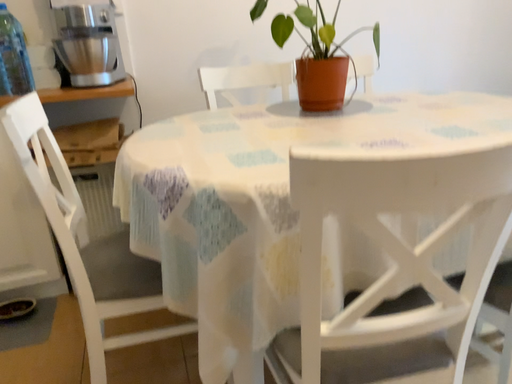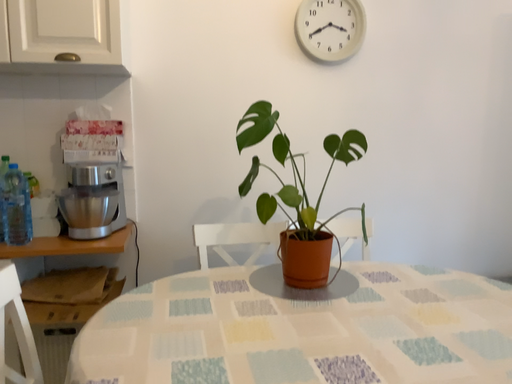
Question: How did the camera likely rotate when shooting the video?

Choices:
 (A) rotated upward
 (B) rotated downward

Answer: (A)